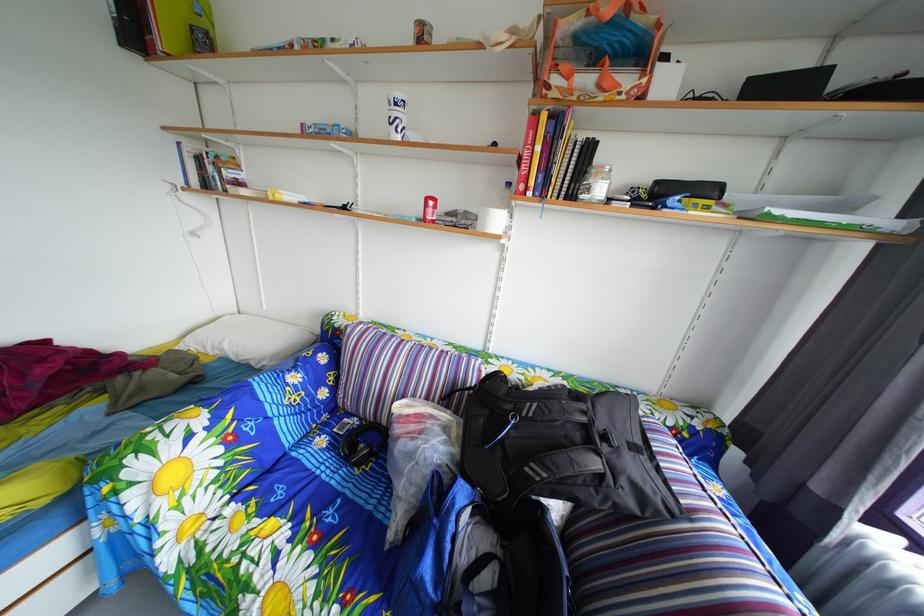
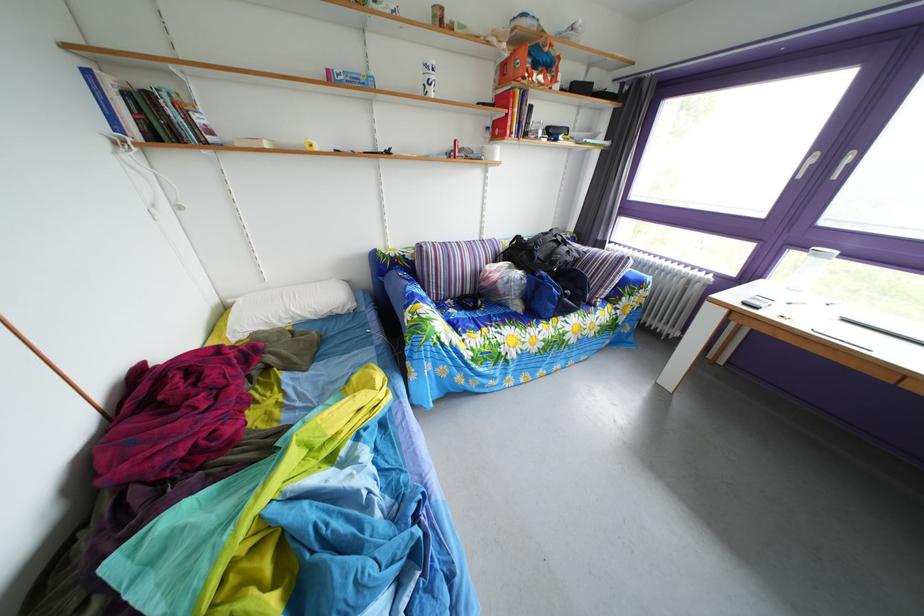
Locate, in the second image, the point that corresponds to (333,448) in the first image.

(463, 320)